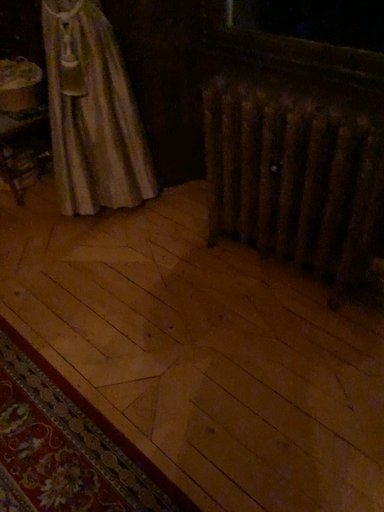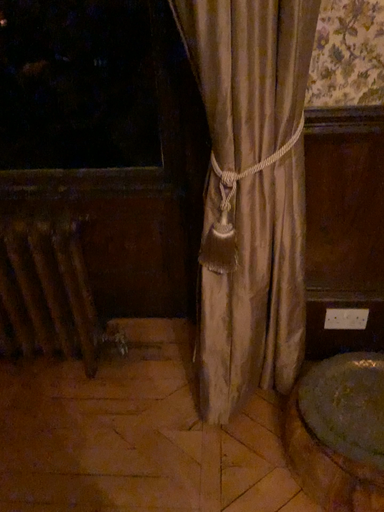
Question: How did the camera likely rotate when shooting the video?

Choices:
 (A) rotated upward
 (B) rotated downward

Answer: (A)